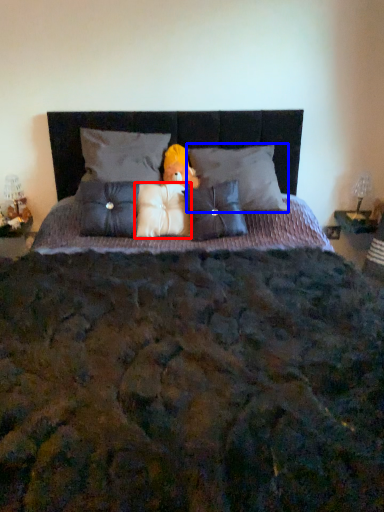
Question: Which object appears closest to the camera in this image, pillow (highlighted by a red box) or pillow (highlighted by a blue box)?

Choices:
 (A) pillow
 (B) pillow

Answer: (B)